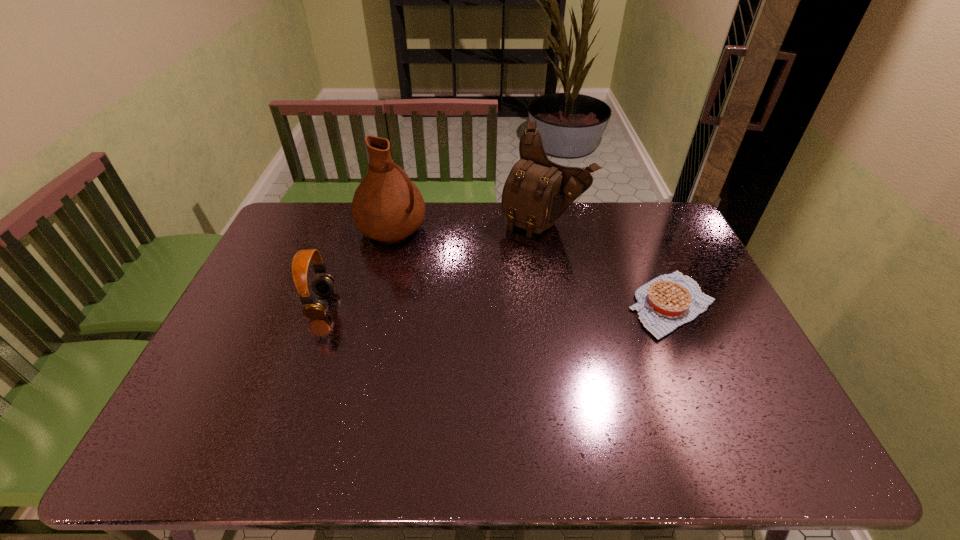
Locate an element on the screen. The width and height of the screenshot is (960, 540). headset is located at coordinates (323, 285).

Locate an element on the screen. Image resolution: width=960 pixels, height=540 pixels. the rightmost object is located at coordinates (668, 301).

Locate an element on the screen. The height and width of the screenshot is (540, 960). the shortest object is located at coordinates pyautogui.click(x=668, y=301).

At what (x,y) coordinates should I click in order to perform the action: click on the third object from left to right. Please return your answer as a coordinate pair (x, y). The width and height of the screenshot is (960, 540). Looking at the image, I should click on (537, 191).

I want to click on pitcher, so click(387, 206).

You are a GUI agent. You are given a task and a screenshot of the screen. Output one action in this format:
    pyautogui.click(x=<x>, y=<y>)
    Task: Click on the free region located 0.360m on the ear cups of the headset
    The width and height of the screenshot is (960, 540).
    Given the screenshot: What is the action you would take?
    pyautogui.click(x=455, y=305)

Locate an element on the screen. free region located on the front of the pie is located at coordinates (707, 386).

I want to click on free space located 0.300m on the front-facing side of the shoulder bag, so click(x=477, y=289).

Where is `free spot located on the front-facing side of the shoulder bag`? free spot located on the front-facing side of the shoulder bag is located at coordinates (515, 247).

Identify the location of vacant space located 0.150m on the front-facing side of the shoulder bag. (501, 261).